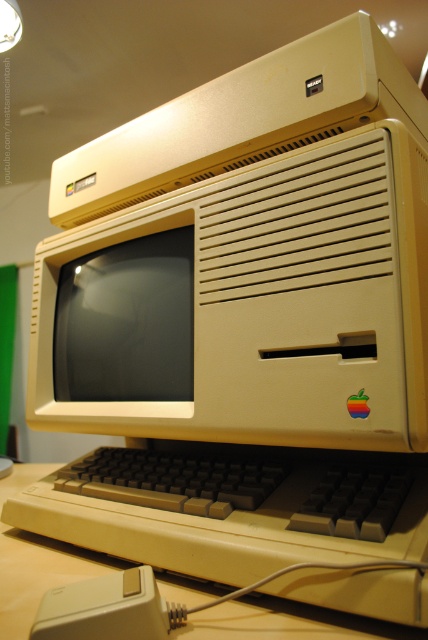
Does beige plastic keyboard at center appear on the left side of white plastic mouse at lower left?

Indeed, beige plastic keyboard at center is positioned on the left side of white plastic mouse at lower left.

Describe the element at coordinates (285, 624) in the screenshot. I see `beige plastic keyboard at center` at that location.

The height and width of the screenshot is (640, 428). Find the location of `beige plastic keyboard at center`. beige plastic keyboard at center is located at coordinates (285, 624).

Is point (181, 392) closer to viewer compared to point (98, 616)?

No, (181, 392) is further to viewer.

Is matte plastic monitor at center above white plastic mouse at lower left?

Yes.

Is point (113, 337) positioned in front of point (64, 595)?

No, (113, 337) is behind (64, 595).

Identify the location of matte plastic monitor at center. The height and width of the screenshot is (640, 428). (127, 321).

Does point (175, 236) come behind point (14, 552)?

Yes, point (175, 236) is behind point (14, 552).

Is matte plastic monitor at center positioned before beige plastic keyboard at center?

No, it is not.

Is point (80, 358) closer to camera compared to point (232, 636)?

That is False.

Identify the location of matte plastic monitor at center. (127, 321).